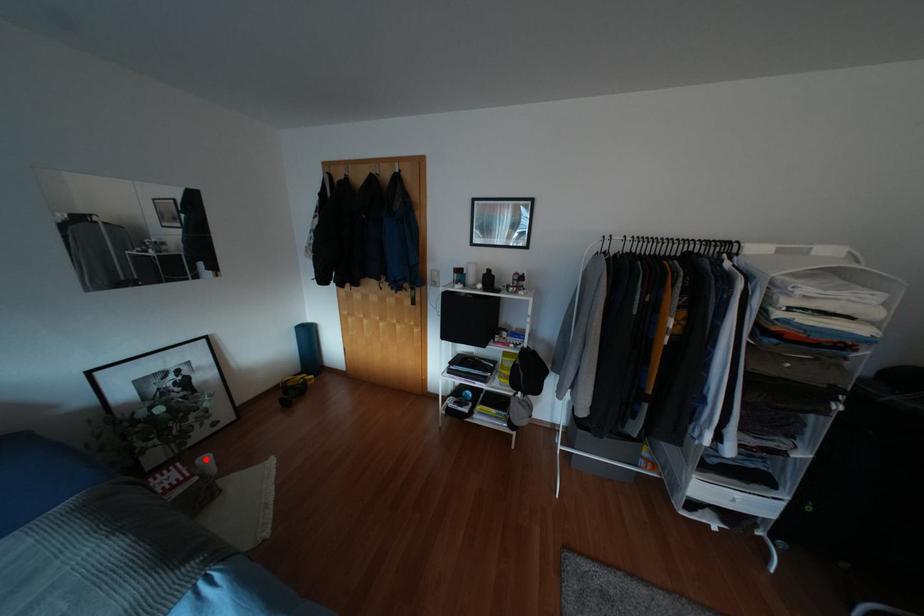
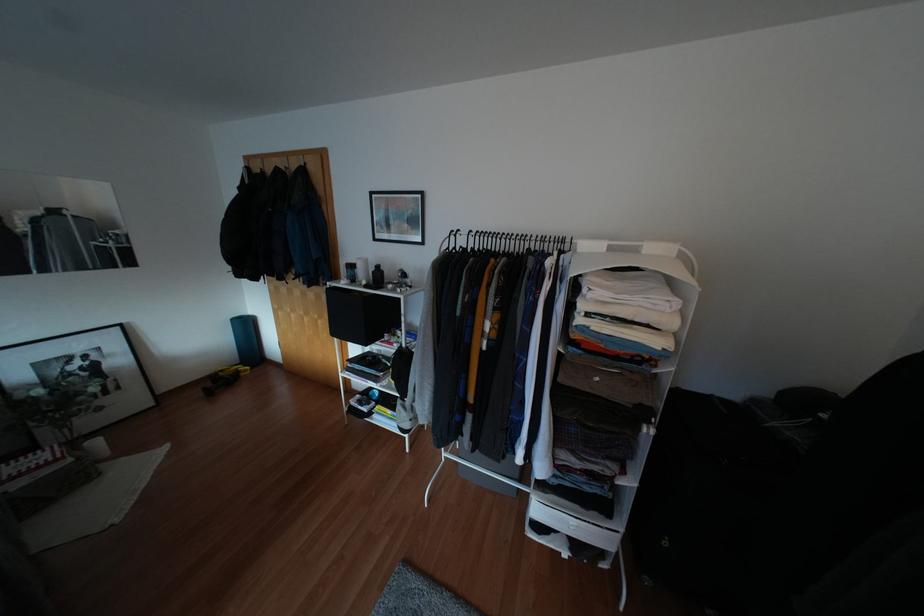
Where in the second image is the point corresponding to the highlighted location from the first image?

(94, 442)